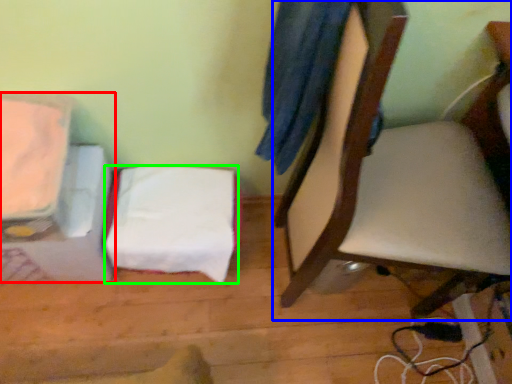
Question: Considering the real-world distances, which object is closest to furniture (highlighted by a red box)? chair (highlighted by a blue box) or sheet (highlighted by a green box).

Choices:
 (A) chair
 (B) sheet

Answer: (B)